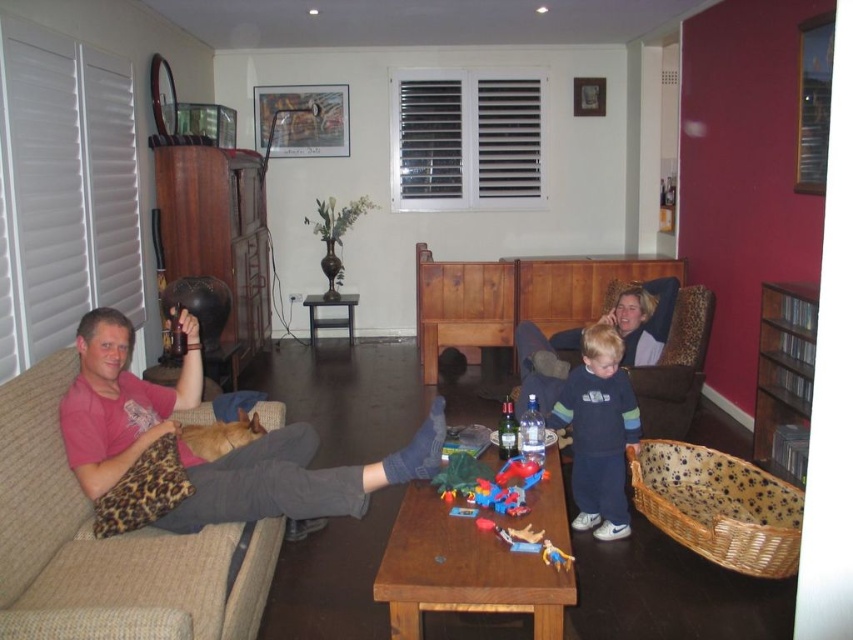
You are a guest in the living room and want to greet the man sitting on the beige sofa. To do so, you should walk towards the point at coordinates (294, 477). Is this the correct direction to reach the man?

Yes, because the point at coordinates (294, 477) corresponds to the pink cotton shirt at left, which the man is wearing, so walking towards that point will lead you directly to him.

You are standing in the living room and want to pick up two items located at point (463, 477) and point (543, 547). Which point is closer to you?

Point (463, 477) is closer to you because it is further to the viewer than point (543, 547).

You are a parent looking for your child who is playing in the living room. You see the pink cotton shirt at left and the rubber yellow toy at lower center. Which object is higher up from the floor?

The pink cotton shirt at left is above the rubber yellow toy at lower center, so the pink cotton shirt at left is higher up from the floor.